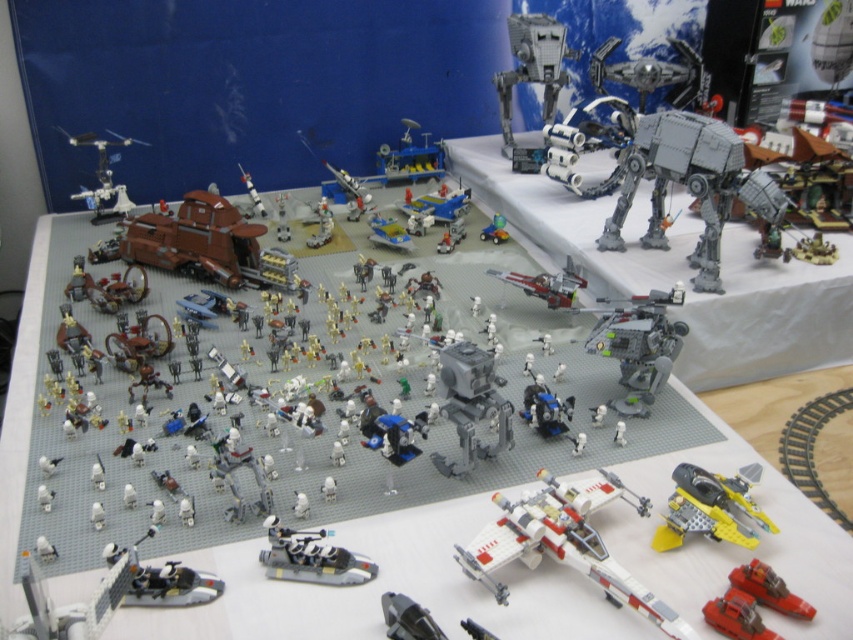
You are a LEGO figure standing on the shiny silver spaceship at lower center. You want to get to the shiny silver motorcycle at lower left. Which direction should you move to reach it?

The shiny silver motorcycle at lower left is above the shiny silver spaceship at lower center, so to reach it, you should move upward from the shiny silver spaceship at lower center.